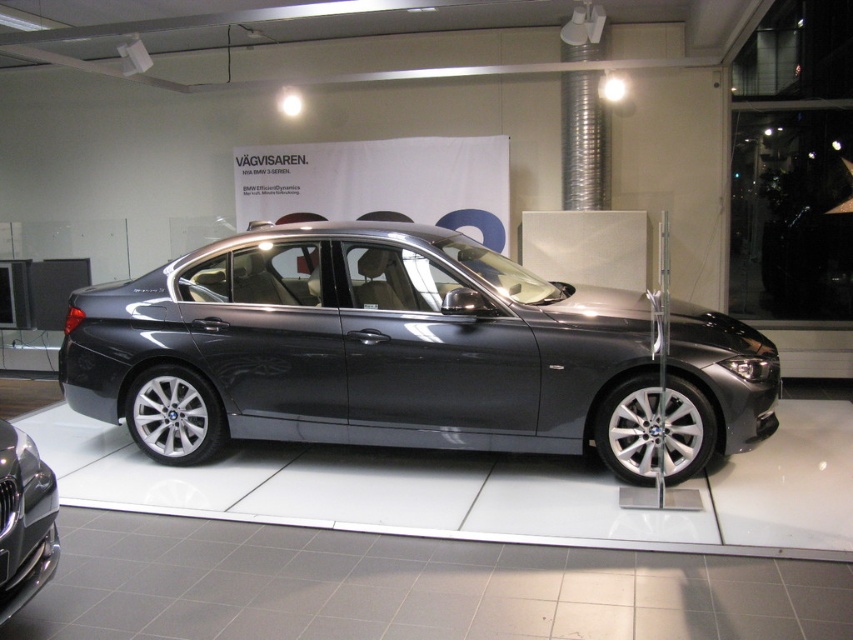
Does satin metallic car at center have a greater height compared to glossy black car at lower left?

Correct, satin metallic car at center is much taller as glossy black car at lower left.

Is the position of satin metallic car at center more distant than that of glossy black car at lower left?

Yes.

I want to click on satin metallic car at center, so click(x=364, y=349).